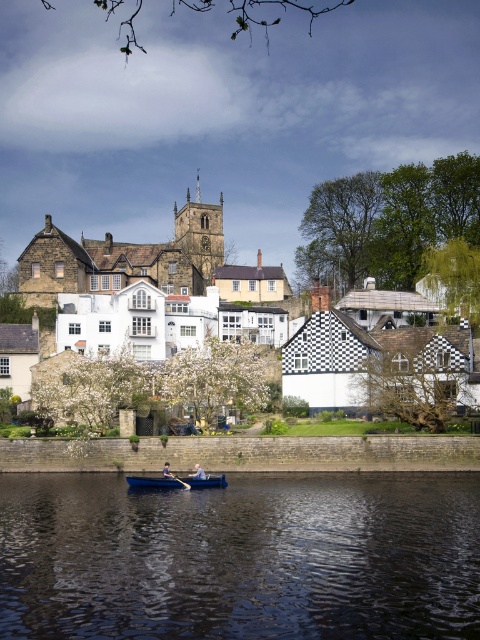
Looking at this image, who is more distant from viewer, (84, 493) or (204, 474)?

Point (204, 474)

Based on the photo, is dark blue water at lower center wider than blue fabric boat at lower center?

Yes, dark blue water at lower center is wider than blue fabric boat at lower center.

Does point (73, 637) lie behind point (192, 476)?

No, (73, 637) is in front of (192, 476).

Identify the location of dark blue water at lower center. The width and height of the screenshot is (480, 640). (240, 557).

Is blue fabric boat at lower center smaller than wooden paddle at center?

No.

Is blue fabric boat at lower center positioned at the back of wooden paddle at center?

Yes.

Who is more distant from viewer, (194,476) or (189,484)?

The point (194,476) is more distant.

Identify the location of blue fabric boat at lower center. (197, 472).

What do you see at coordinates (240, 557) in the screenshot? This screenshot has width=480, height=640. I see `dark blue water at lower center` at bounding box center [240, 557].

The height and width of the screenshot is (640, 480). I want to click on dark blue water at lower center, so click(x=240, y=557).